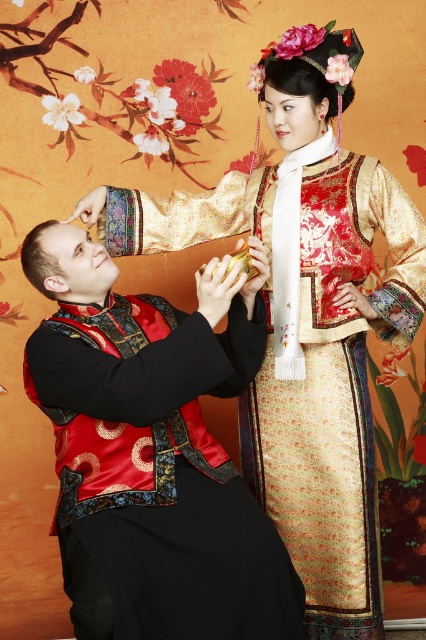
Question: Is satin black vest at center positioned behind shiny gold brocade dress at center?

Choices:
 (A) yes
 (B) no

Answer: (B)

Question: Considering the relative positions of satin black vest at center and shiny gold brocade dress at center in the image provided, where is satin black vest at center located with respect to shiny gold brocade dress at center?

Choices:
 (A) below
 (B) above

Answer: (A)

Question: Which point is closer to the camera taking this photo?

Choices:
 (A) (267, 195)
 (B) (97, 260)

Answer: (B)

Question: Can you confirm if satin black vest at center is positioned to the right of shiny gold brocade dress at center?

Choices:
 (A) no
 (B) yes

Answer: (A)

Question: Which point is farther to the camera?

Choices:
 (A) shiny gold brocade dress at center
 (B) satin black vest at center

Answer: (A)